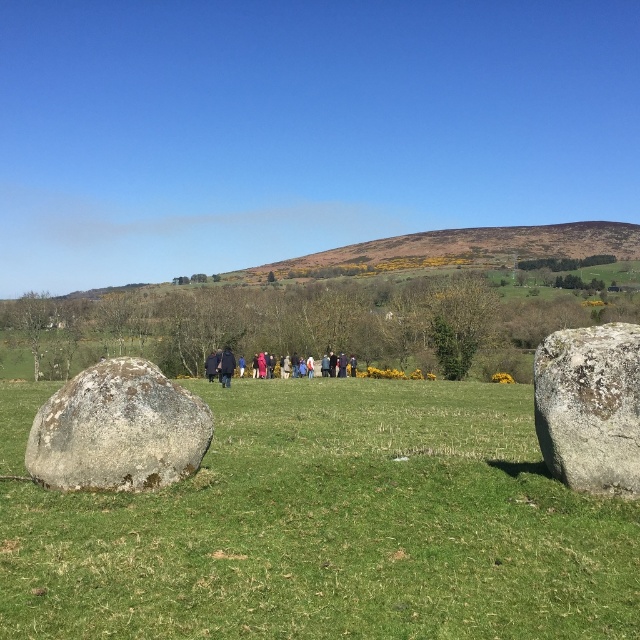
Does gray rough boulder at left have a larger size compared to brown grassy hillside at center?

No, gray rough boulder at left is not bigger than brown grassy hillside at center.

Is gray rough boulder at left below brown grassy hillside at center?

Yes, gray rough boulder at left is below brown grassy hillside at center.

Find the location of a particular element. gray rough boulder at left is located at coordinates (116, 429).

Is brown grassy hillside at center positioned in front of dark blue coat at center?

No, brown grassy hillside at center is further to the viewer.

Can you confirm if brown grassy hillside at center is positioned to the right of dark blue coat at center?

Yes, brown grassy hillside at center is to the right of dark blue coat at center.

Is point (472, 227) positioned in front of point (234, 362)?

No, (472, 227) is further to viewer.

Identify the location of brown grassy hillside at center. (461, 250).

Does speckled gray rock at center have a greater width compared to dark blue coat at center?

In fact, speckled gray rock at center might be narrower than dark blue coat at center.

Between speckled gray rock at center and dark blue coat at center, which one has less height?

dark blue coat at center

Identify the location of speckled gray rock at center. (589, 406).